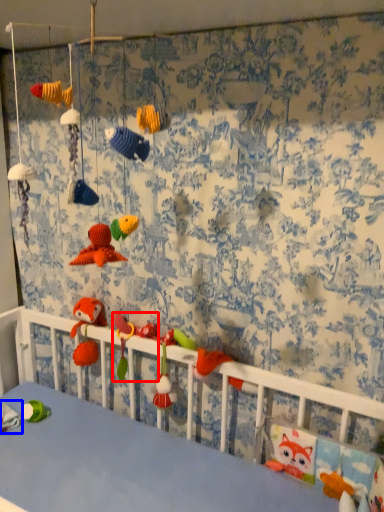
Question: Which point is further to the camera, toy (highlighted by a red box) or toy (highlighted by a blue box)?

Choices:
 (A) toy
 (B) toy

Answer: (A)